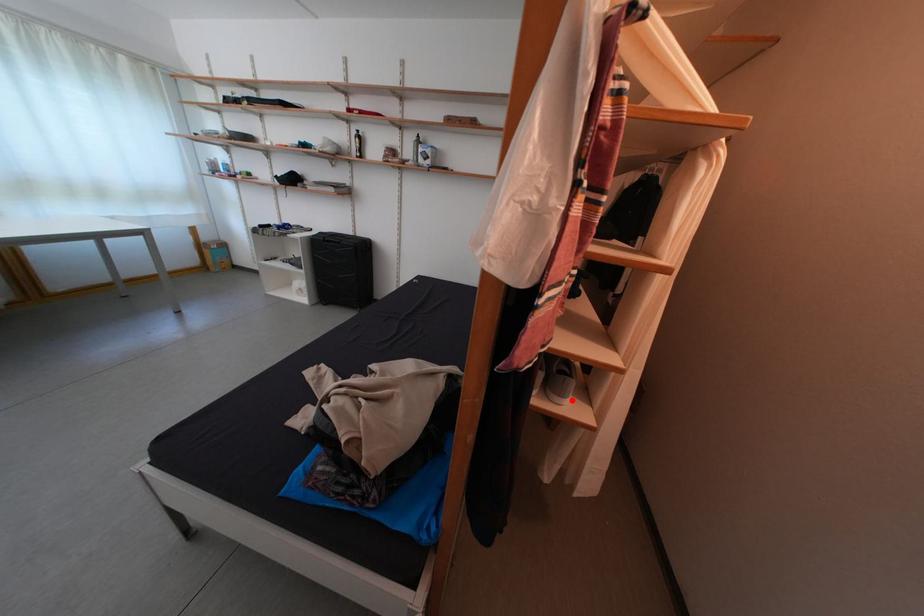
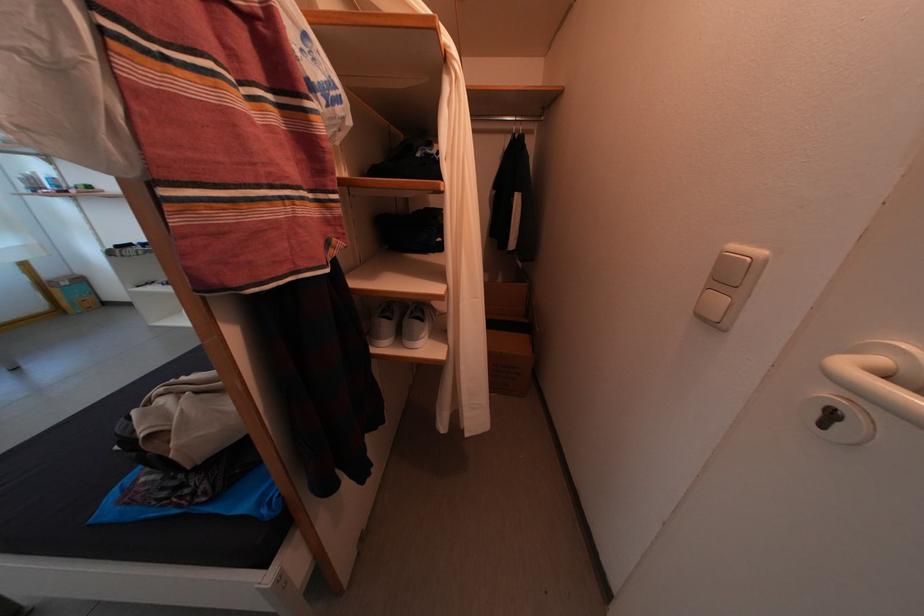
Question: I am providing you with two images of the same scene from different viewpoints. Given a red point in image1, look at the same physical point in image2. Is it:

Choices:
 (A) Closer to the viewpoint
 (B) Farther from the viewpoint

Answer: (A)